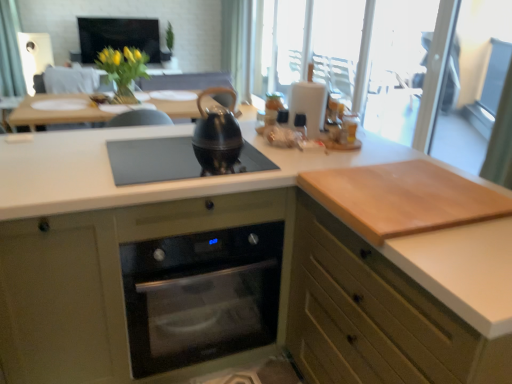
Question: From the image's perspective, would you say transparent glass screen door at upper right is positioned over matte black screen at upper center?

Choices:
 (A) no
 (B) yes

Answer: (A)

Question: Is transparent glass screen door at upper right beside matte black screen at upper center?

Choices:
 (A) yes
 (B) no

Answer: (B)

Question: Considering the relative sizes of transparent glass screen door at upper right and matte black screen at upper center in the image provided, is transparent glass screen door at upper right taller than matte black screen at upper center?

Choices:
 (A) no
 (B) yes

Answer: (B)

Question: Would you consider transparent glass screen door at upper right to be distant from matte black screen at upper center?

Choices:
 (A) yes
 (B) no

Answer: (A)

Question: Is transparent glass screen door at upper right smaller than matte black screen at upper center?

Choices:
 (A) no
 (B) yes

Answer: (B)

Question: Considering the positions of black matte kettle at center and black glass gas stove at center in the image, is black matte kettle at center wider or thinner than black glass gas stove at center?

Choices:
 (A) wide
 (B) thin

Answer: (B)

Question: In the image, is black matte kettle at center on the left side or the right side of black glass gas stove at center?

Choices:
 (A) right
 (B) left

Answer: (A)

Question: Considering the positions of black matte kettle at center and black glass gas stove at center in the image, is black matte kettle at center taller or shorter than black glass gas stove at center?

Choices:
 (A) tall
 (B) short

Answer: (A)

Question: Is point (199, 137) closer or farther from the camera than point (122, 152)?

Choices:
 (A) farther
 (B) closer

Answer: (A)

Question: From the image's perspective, relative to olive green wood oven at center, the 1th cabinetry when ordered from left to right, is black glass gas stove at center above or below?

Choices:
 (A) below
 (B) above

Answer: (B)

Question: Is black glass gas stove at center taller or shorter than olive green wood oven at center, which is the second cabinetry in right-to-left order?

Choices:
 (A) short
 (B) tall

Answer: (A)

Question: Based on their sizes in the image, would you say black glass gas stove at center is bigger or smaller than olive green wood oven at center, the 1th cabinetry when ordered from left to right?

Choices:
 (A) small
 (B) big

Answer: (A)

Question: Considering the relative positions of black glass gas stove at center and olive green wood oven at center, the 1th cabinetry when ordered from left to right, in the image provided, is black glass gas stove at center to the left or to the right of olive green wood oven at center, the 1th cabinetry when ordered from left to right,?

Choices:
 (A) left
 (B) right

Answer: (B)

Question: Considering their positions, is stainless steel oven at center located in front of or behind light brown wood cutting board at right?

Choices:
 (A) front
 (B) behind

Answer: (B)

Question: Is stainless steel oven at center spatially inside light brown wood cutting board at right, or outside of it?

Choices:
 (A) inside
 (B) outside

Answer: (B)